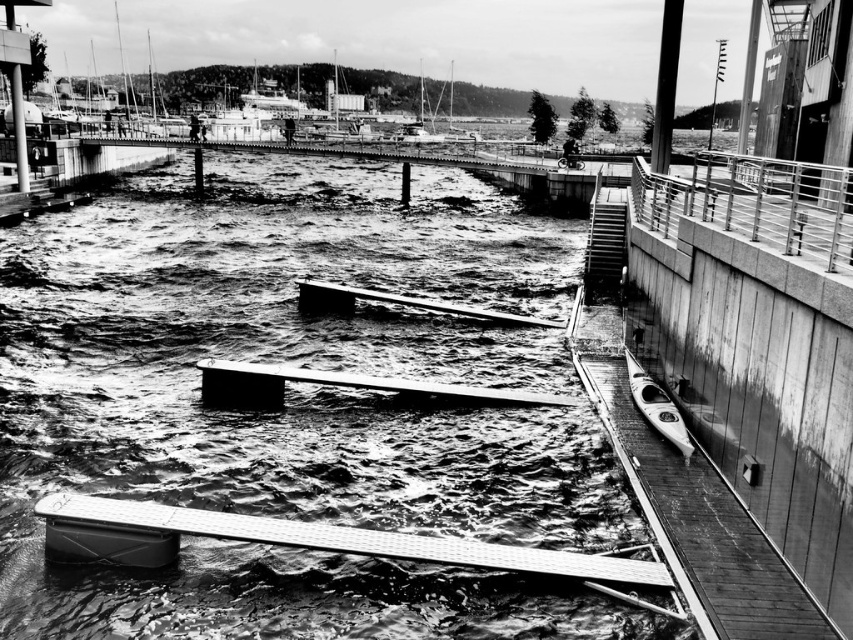
You are a photographer trying to capture the smooth gray dock at center and the white glossy kayak at lower right in a single shot. Based on their positions, will the kayak be visible in the frame if you focus on the dock?

The smooth gray dock at center is located above the white glossy kayak at lower right, so if you focus on the dock, the kayak should still be visible in the frame as it is positioned below the dock.